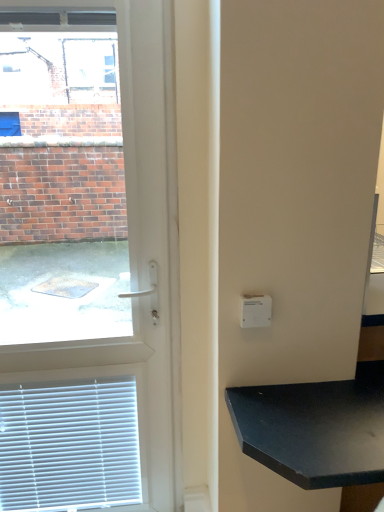
Question: Should I look upward or downward to see white plastic door at left?

Choices:
 (A) down
 (B) up

Answer: (A)

Question: Is white plastic light switch at upper right behind black matte table at lower right?

Choices:
 (A) yes
 (B) no

Answer: (A)

Question: Does white plastic light switch at upper right have a lesser height compared to black matte table at lower right?

Choices:
 (A) yes
 (B) no

Answer: (A)

Question: From a real-world perspective, is white plastic light switch at upper right positioned under black matte table at lower right based on gravity?

Choices:
 (A) no
 (B) yes

Answer: (A)

Question: Is white plastic light switch at upper right located outside black matte table at lower right?

Choices:
 (A) yes
 (B) no

Answer: (A)

Question: Is the surface of white plastic light switch at upper right in direct contact with black matte table at lower right?

Choices:
 (A) yes
 (B) no

Answer: (B)

Question: From the image's perspective, is white plastic light switch at upper right located beneath black matte table at lower right?

Choices:
 (A) no
 (B) yes

Answer: (A)

Question: Is white plastic light switch at upper right thinner than white plastic door at left?

Choices:
 (A) no
 (B) yes

Answer: (B)

Question: Does white plastic light switch at upper right have a larger size compared to white plastic door at left?

Choices:
 (A) yes
 (B) no

Answer: (B)

Question: Is white plastic light switch at upper right taller than white plastic door at left?

Choices:
 (A) no
 (B) yes

Answer: (A)

Question: From a real-world perspective, is white plastic light switch at upper right on top of white plastic door at left?

Choices:
 (A) yes
 (B) no

Answer: (A)

Question: Is white plastic door at left at the back of white plastic light switch at upper right?

Choices:
 (A) yes
 (B) no

Answer: (B)

Question: Considering the relative sizes of white plastic light switch at upper right and white plastic door at left in the image provided, is white plastic light switch at upper right wider than white plastic door at left?

Choices:
 (A) yes
 (B) no

Answer: (B)

Question: Can you confirm if white plastic door at left is taller than black matte table at lower right?

Choices:
 (A) no
 (B) yes

Answer: (B)